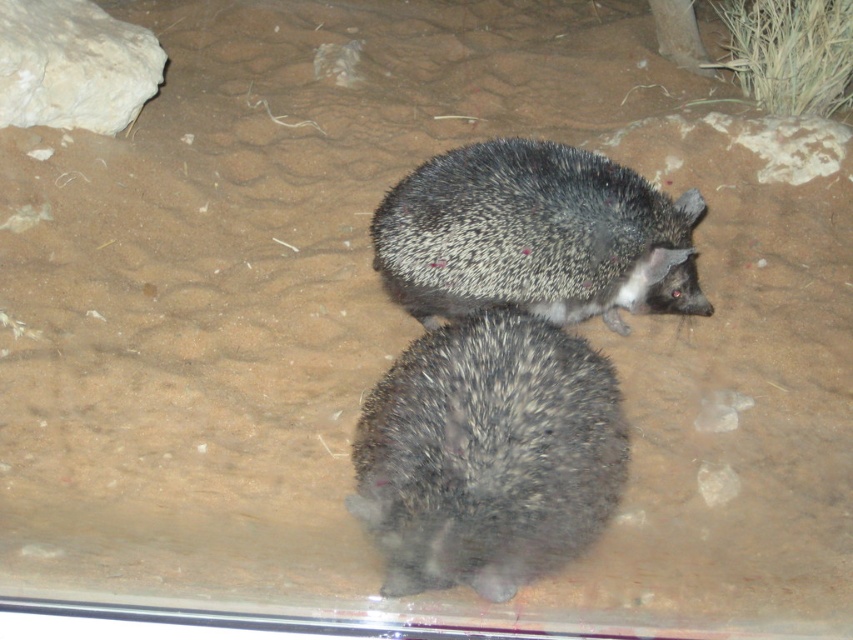
Question: Which of the following is the closest to the observer?

Choices:
 (A) dark gray spiny hedgehog at center
 (B) white rough rock at upper left

Answer: (A)

Question: Can you confirm if dark gray spiny hedgehog at center is bigger than white rough rock at upper left?

Choices:
 (A) no
 (B) yes

Answer: (B)

Question: Can you confirm if dark gray spiny hedgehog at center is smaller than spiny black hedgehog at center?

Choices:
 (A) yes
 (B) no

Answer: (A)

Question: Which point is closer to the camera taking this photo?

Choices:
 (A) (462, 300)
 (B) (109, 42)

Answer: (A)

Question: In this image, where is dark gray spiny hedgehog at center located relative to white rough rock at upper left?

Choices:
 (A) left
 (B) right

Answer: (B)

Question: Which object is farther from the camera taking this photo?

Choices:
 (A) dark gray spiny hedgehog at center
 (B) spiny black hedgehog at center

Answer: (B)